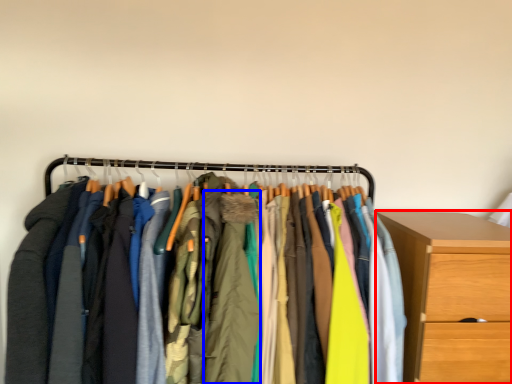
Question: Which object is closer to the camera taking this photo, chest of drawers (highlighted by a red box) or clothing (highlighted by a blue box)?

Choices:
 (A) chest of drawers
 (B) clothing

Answer: (B)